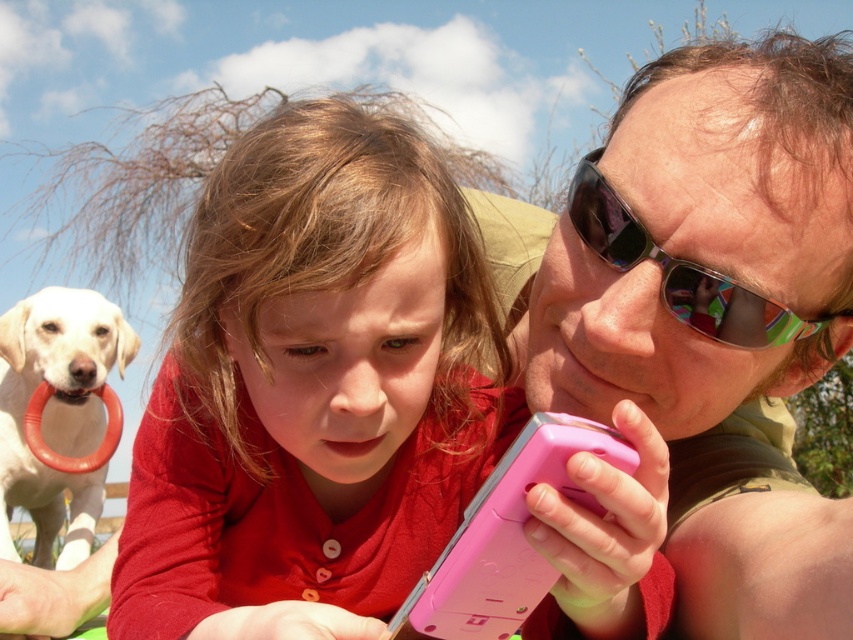
Does white matte dog at left have a larger size compared to pink plastic smartphone at center?

Yes.

Does white matte dog at left appear over pink plastic smartphone at center?

No.

Is point (73, 449) closer to viewer compared to point (467, 529)?

No, (73, 449) is further to viewer.

At what (x,y) coordinates should I click in order to perform the action: click on white matte dog at left. Please return your answer as a coordinate pair (x, y). Looking at the image, I should click on (56, 412).

Does pink matte phone at center have a greater width compared to white matte dog at left?

Yes.

Does pink matte phone at center appear over white matte dog at left?

Yes.

This screenshot has height=640, width=853. What are the coordinates of `pink matte phone at center` in the screenshot? It's located at (717, 320).

The image size is (853, 640). What are the coordinates of `pink matte phone at center` in the screenshot? It's located at (717, 320).

Which of these two, matte pink phone at center or pink matte phone at center, stands taller?

With more height is pink matte phone at center.

What do you see at coordinates (314, 388) in the screenshot?
I see `matte pink phone at center` at bounding box center [314, 388].

Is point (451, 497) positioned behind point (757, 314)?

Yes, point (451, 497) is farther from viewer.

The image size is (853, 640). Find the location of `matte pink phone at center`. matte pink phone at center is located at coordinates (314, 388).